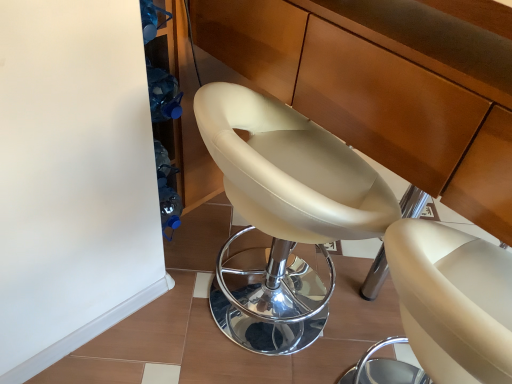
Question: Should I look upward or downward to see matte wood cabinet at center?

Choices:
 (A) down
 (B) up

Answer: (B)